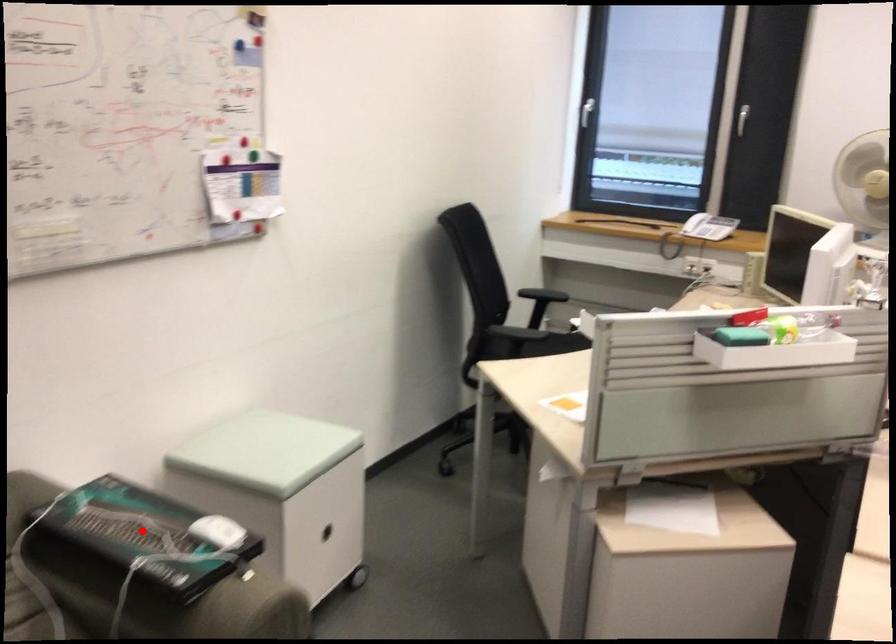
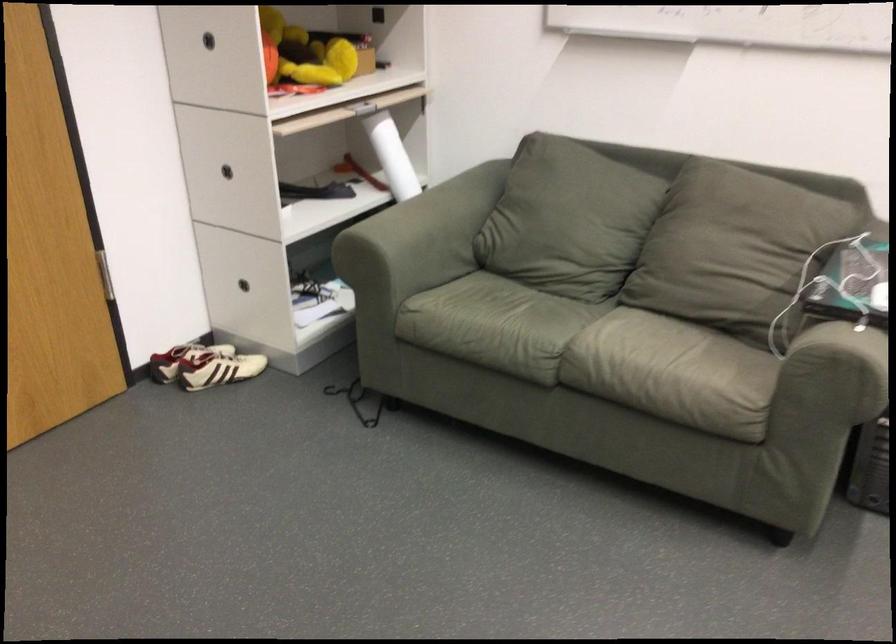
Locate, in the second image, the point that corresponds to the highlighted location in the first image.

(851, 279)